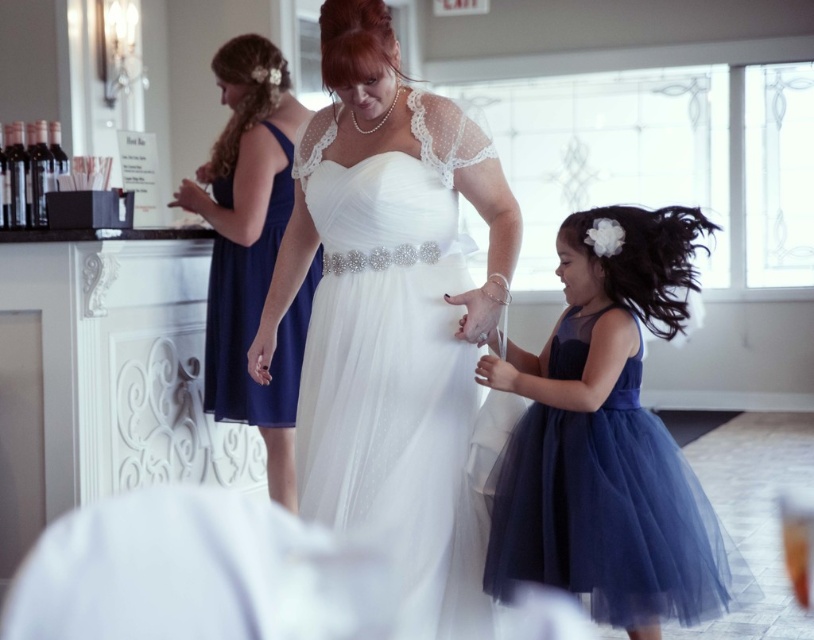
Between navy tulle dress at lower right and navy satin dress at upper left, which one is positioned higher?

navy satin dress at upper left is higher up.

Locate an element on the screen. The width and height of the screenshot is (814, 640). navy tulle dress at lower right is located at coordinates (606, 436).

Does point (602, 330) come farther from viewer compared to point (213, 305)?

No, (602, 330) is closer to viewer.

You are a GUI agent. You are given a task and a screenshot of the screen. Output one action in this format:
    pyautogui.click(x=<x>, y=<y>)
    Task: Click on the navy tulle dress at lower right
    This screenshot has width=814, height=640.
    Given the screenshot: What is the action you would take?
    pyautogui.click(x=606, y=436)

Who is more forward, (322, 484) or (289, 408)?

Point (322, 484) is more forward.

Which is above, satin white gown at center or navy satin dress at upper left?

navy satin dress at upper left

Describe the element at coordinates (392, 317) in the screenshot. I see `satin white gown at center` at that location.

What are the coordinates of `satin white gown at center` in the screenshot? It's located at tap(392, 317).

Is navy tulle dress at lower right to the left of white lace dress at center from the viewer's perspective?

Incorrect, navy tulle dress at lower right is not on the left side of white lace dress at center.

Which is below, navy tulle dress at lower right or white lace dress at center?

navy tulle dress at lower right is lower down.

Is point (508, 374) positioned behind point (290, 380)?

No, it is in front of (290, 380).

Identify the location of navy tulle dress at lower right. (606, 436).